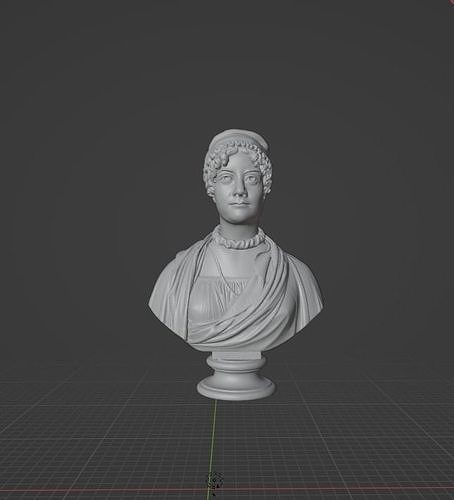
At what (x,y) coordinates should I click in order to perform the action: click on artwork. Please return your answer as a coordinate pair (x, y). This screenshot has width=454, height=500. Looking at the image, I should click on (271, 329).